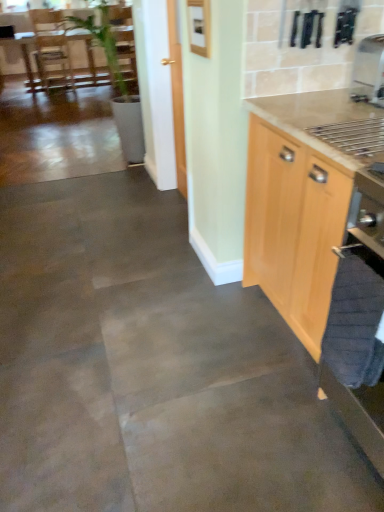
Identify the location of vacant point above light wood cabinet at right (from a real-world perspective). The height and width of the screenshot is (512, 384). click(x=338, y=113).